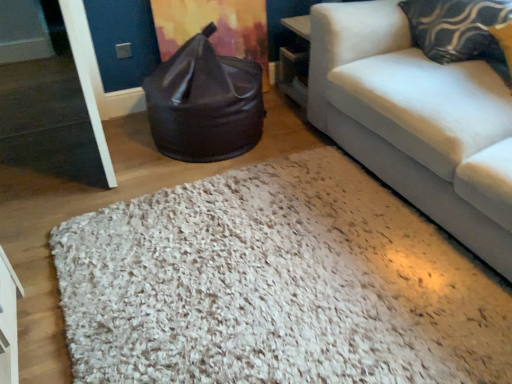
Identify the location of free location to the left of black leather bean bag at center. Image resolution: width=512 pixels, height=384 pixels. (88, 157).